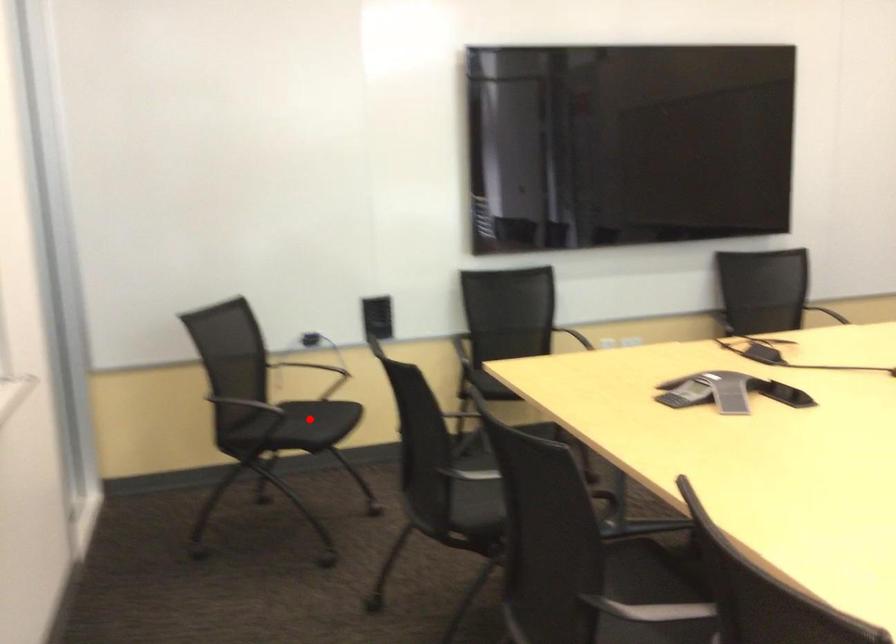
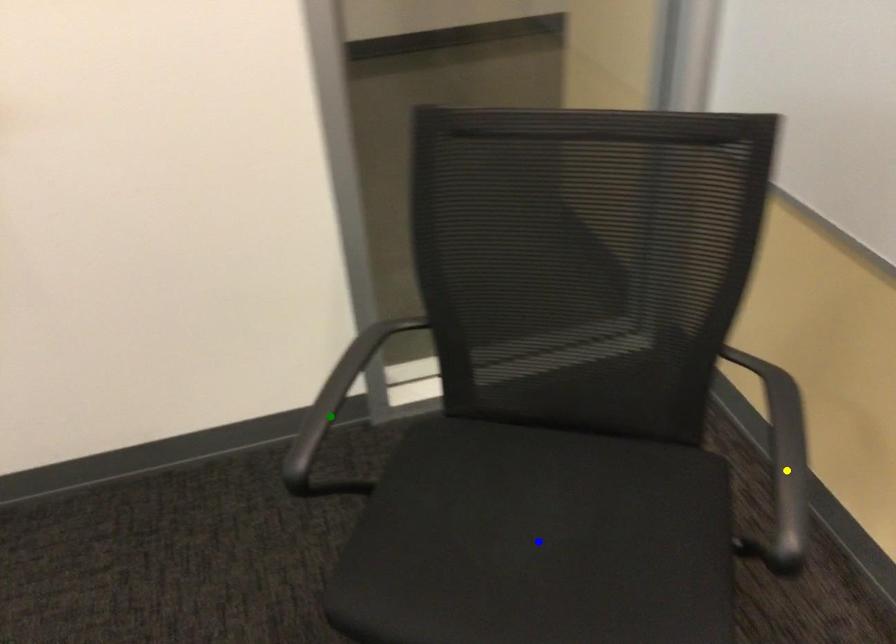
Question: I am providing you with two images of the same scene from different viewpoints. A red point is marked on the first image. You are given multiple points on the second image. Which mark in image 2 goes with the point in image 1?

Choices:
 (A) yellow point
 (B) blue point
 (C) green point

Answer: (B)